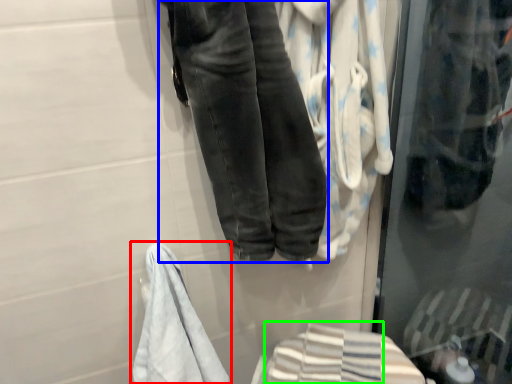
Question: Which object is the farthest from towel (highlighted by a red box)? Choose among these: trousers (highlighted by a blue box) or bath towel (highlighted by a green box).

Choices:
 (A) trousers
 (B) bath towel

Answer: (A)